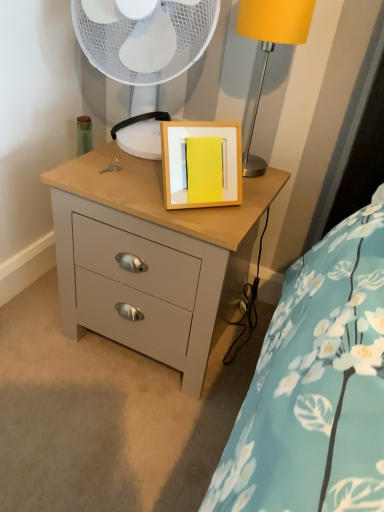
Question: From a real-world perspective, is matte yellow lampshade at upper right positioned over white plastic fan at upper center based on gravity?

Choices:
 (A) yes
 (B) no

Answer: (A)

Question: Considering the relative sizes of matte yellow lampshade at upper right and white plastic fan at upper center in the image provided, is matte yellow lampshade at upper right shorter than white plastic fan at upper center?

Choices:
 (A) no
 (B) yes

Answer: (A)

Question: Is the depth of matte yellow lampshade at upper right greater than that of white plastic fan at upper center?

Choices:
 (A) yes
 (B) no

Answer: (B)

Question: Would you say matte yellow lampshade at upper right is a long distance from white plastic fan at upper center?

Choices:
 (A) no
 (B) yes

Answer: (A)

Question: Is matte yellow lampshade at upper right oriented away from white plastic fan at upper center?

Choices:
 (A) yes
 (B) no

Answer: (B)

Question: Is white plastic fan at upper center bigger or smaller than matte yellow lampshade at upper right?

Choices:
 (A) small
 (B) big

Answer: (B)

Question: From a real-world perspective, is white plastic fan at upper center physically located above or below matte yellow lampshade at upper right?

Choices:
 (A) above
 (B) below

Answer: (B)

Question: Is white plastic fan at upper center in front of or behind matte yellow lampshade at upper right in the image?

Choices:
 (A) behind
 (B) front

Answer: (A)

Question: From their relative heights in the image, would you say white plastic fan at upper center is taller or shorter than matte yellow lampshade at upper right?

Choices:
 (A) tall
 (B) short

Answer: (B)

Question: From the image's perspective, is matte yellow lampshade at upper right positioned above or below matte gray chest of drawers at center?

Choices:
 (A) below
 (B) above

Answer: (B)

Question: In the image, is matte yellow lampshade at upper right on the left side or the right side of matte gray chest of drawers at center?

Choices:
 (A) right
 (B) left

Answer: (A)

Question: Based on their sizes in the image, would you say matte yellow lampshade at upper right is bigger or smaller than matte gray chest of drawers at center?

Choices:
 (A) big
 (B) small

Answer: (B)

Question: Do you think matte yellow lampshade at upper right is within matte gray chest of drawers at center, or outside of it?

Choices:
 (A) inside
 (B) outside

Answer: (B)

Question: Is matte yellow lampshade at upper right bigger or smaller than white plastic fan at upper center?

Choices:
 (A) big
 (B) small

Answer: (B)

Question: In the image, is matte yellow lampshade at upper right on the left side or the right side of white plastic fan at upper center?

Choices:
 (A) right
 (B) left

Answer: (A)